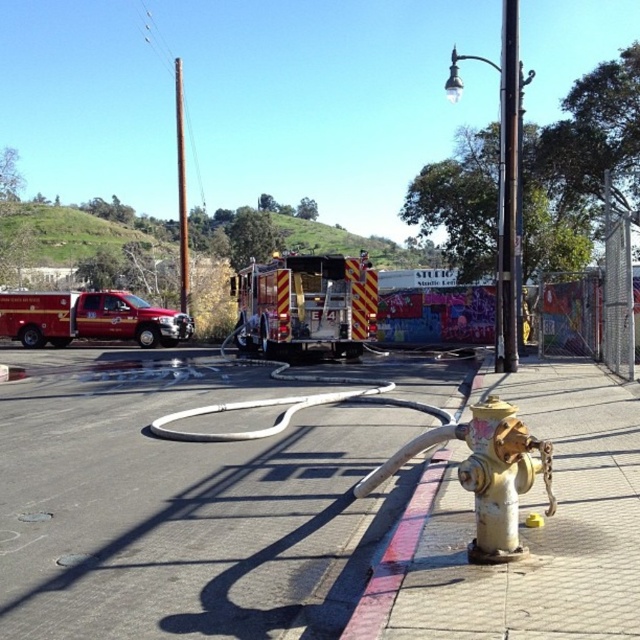
Question: Does dark brown metal pole at upper right appear over brushed metal pole at upper center?

Choices:
 (A) no
 (B) yes

Answer: (A)

Question: Estimate the real-world distances between objects in this image. Which object is farther from the yellow painted metal hydrant at lower right?

Choices:
 (A) brushed metal pole at upper center
 (B) yellow metallic hydrant at lower right
 (C) reflective silver fire truck at center
 (D) yellow matte hydrant at lower right

Answer: (A)

Question: Is white rubber hose at center above dark brown metal pole at upper right?

Choices:
 (A) no
 (B) yes

Answer: (A)

Question: Which object is the farthest from the reflective silver fire truck at center?

Choices:
 (A) yellow painted metal hydrant at lower right
 (B) brushed metal pole at upper center
 (C) yellow metallic hydrant at lower right

Answer: (C)

Question: Is yellow matte hydrant at lower right to the right of metallic red fire truck at left from the viewer's perspective?

Choices:
 (A) no
 (B) yes

Answer: (B)

Question: Which of these objects is positioned closest to the metallic red fire truck at left?

Choices:
 (A) white rubber hose at center
 (B) yellow painted metal hydrant at lower right
 (C) dark brown metal pole at upper right

Answer: (A)